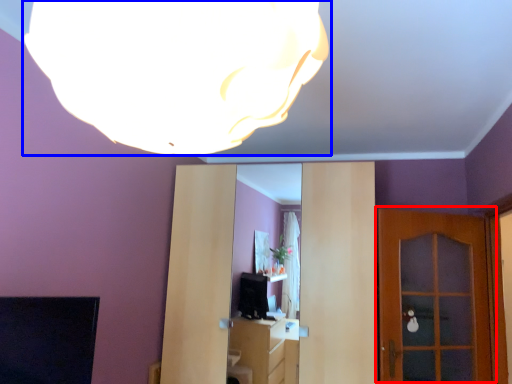
Question: Among these objects, which one is nearest to the camera, door (highlighted by a red box) or lamp (highlighted by a blue box)?

Choices:
 (A) door
 (B) lamp

Answer: (B)